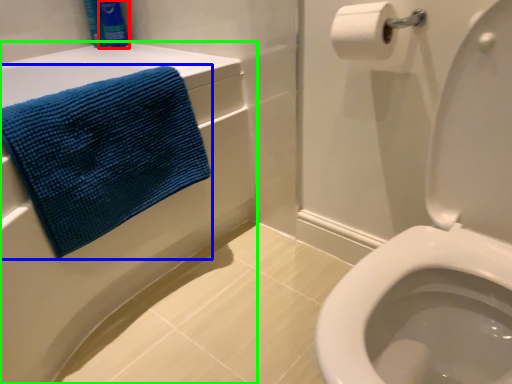
Question: Which object is the closest to the toiletry (highlighted by a red box)? Choose among these: towel (highlighted by a blue box) or bath (highlighted by a green box).

Choices:
 (A) towel
 (B) bath

Answer: (B)